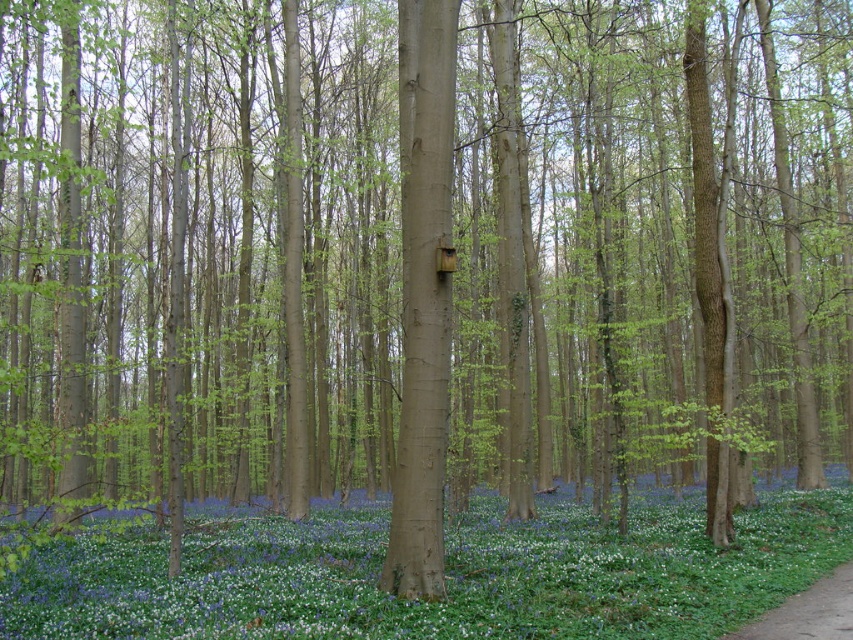
Can you confirm if blue matte flower at center is positioned above brown dirt path at lower right?

No, blue matte flower at center is not above brown dirt path at lower right.

Describe the element at coordinates (445, 576) in the screenshot. This screenshot has height=640, width=853. I see `blue matte flower at center` at that location.

Locate an element on the screen. This screenshot has height=640, width=853. blue matte flower at center is located at coordinates (445, 576).